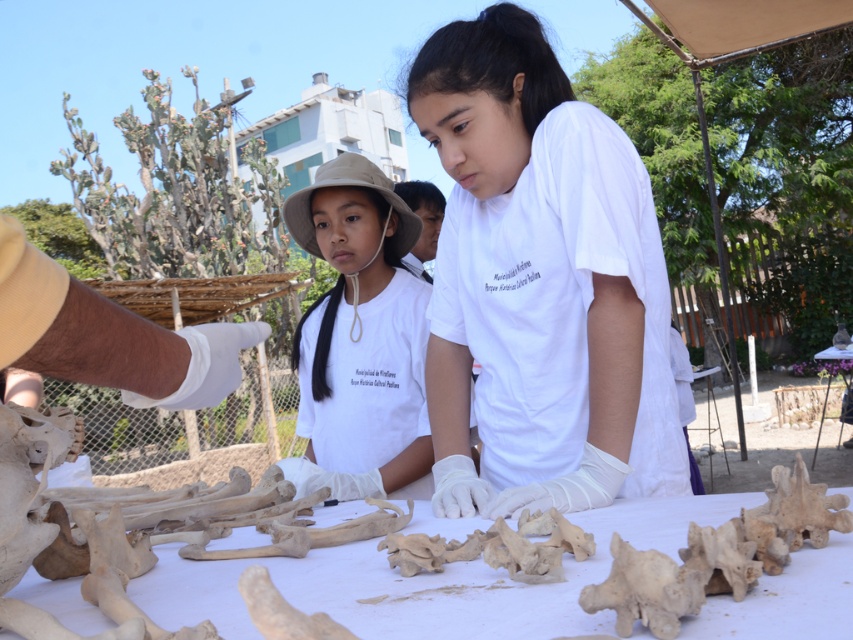
Question: Is the position of bone-white bone at center more distant than that of white porous bone at center?

Choices:
 (A) yes
 (B) no

Answer: (B)

Question: Which is nearer to the white matte shirt at center?

Choices:
 (A) white cotton shirt at center
 (B) white plastic table at center
 (C) white porous bone at center
 (D) bone-white bone at center

Answer: (A)

Question: Among these points, which one is farthest from the camera?

Choices:
 (A) (190, 620)
 (B) (819, 424)

Answer: (B)

Question: Does white matte shirt at center appear over bone-white bone at center?

Choices:
 (A) no
 (B) yes

Answer: (B)

Question: Does white cotton shirt at center have a smaller size compared to white porous bone at center?

Choices:
 (A) yes
 (B) no

Answer: (B)

Question: Which object is positioned farthest from the bone-white bone at center?

Choices:
 (A) white plastic table at center
 (B) white cotton shirt at center

Answer: (A)